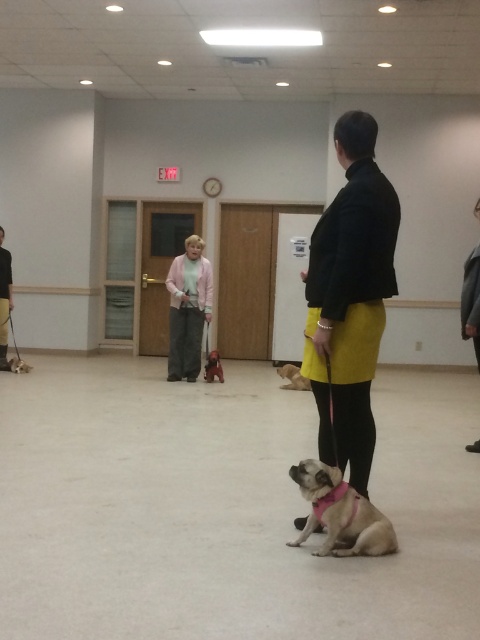
Question: Does black matte skirt at center appear on the left side of light brown fur at lower left?

Choices:
 (A) no
 (B) yes

Answer: (A)

Question: Can you confirm if shiny black dog at center is thinner than light brown fur at lower left?

Choices:
 (A) yes
 (B) no

Answer: (A)

Question: Can you confirm if pink fabric dog at center is positioned above fuzzy beige dog at center?

Choices:
 (A) yes
 (B) no

Answer: (B)

Question: Among these objects, which one is nearest to the camera?

Choices:
 (A) light brown fur at lower left
 (B) fuzzy beige dog at center

Answer: (B)

Question: Among these objects, which one is nearest to the camera?

Choices:
 (A) pink fabric dog at center
 (B) pink fabric jacket at center
 (C) black matte skirt at center

Answer: (A)

Question: Which point appears closest to the camera in this image?

Choices:
 (A) (16, 360)
 (B) (216, 358)
 (C) (356, 520)
 (D) (280, 371)

Answer: (C)